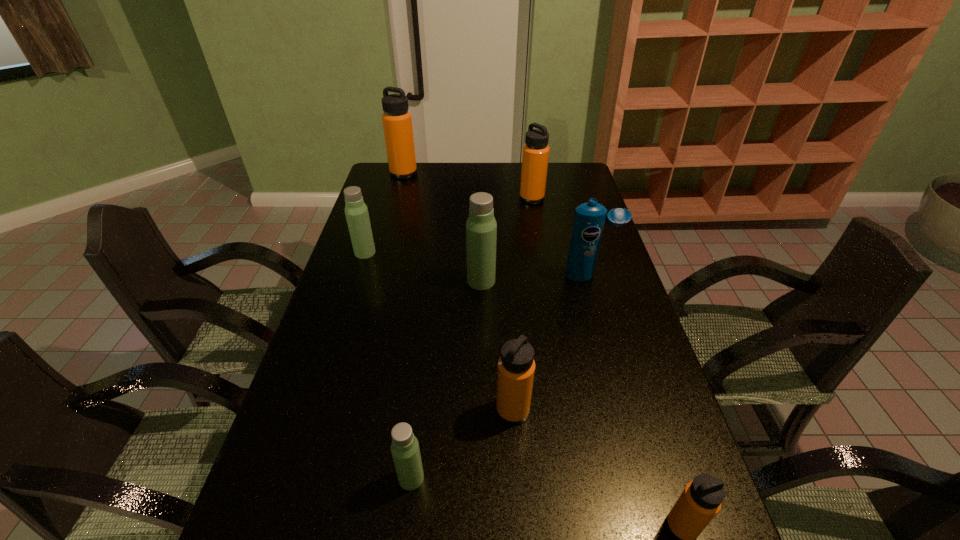
Locate an element on the screen. object at the far edge is located at coordinates (397, 121).

This screenshot has height=540, width=960. I want to click on object situated at the right edge, so click(589, 219).

Find the location of a particular element. The image size is (960, 540). object that is at the far left corner is located at coordinates (397, 121).

In the image, there is a desktop. Where is `vacant region at the left edge`? Image resolution: width=960 pixels, height=540 pixels. vacant region at the left edge is located at coordinates (280, 530).

In the image, there is a desktop. Where is `vacant area at the right edge`? This screenshot has width=960, height=540. vacant area at the right edge is located at coordinates (623, 285).

Locate an element on the screen. vacant area at the far left corner is located at coordinates (377, 169).

Find the location of a particular element. The width and height of the screenshot is (960, 540). vacant point at the far right corner is located at coordinates (558, 166).

Image resolution: width=960 pixels, height=540 pixels. Identify the location of vacant area that lies between the second light thermos bottle from right to left and the third farthest object. (388, 365).

What are the coordinates of `free space between the farthest light thermos bottle and the second nearest light thermos bottle` in the screenshot? It's located at (423, 267).

Where is `free area in between the sixth farthest thermos bottle and the second orange thermos bottle from left to right`? Image resolution: width=960 pixels, height=540 pixels. free area in between the sixth farthest thermos bottle and the second orange thermos bottle from left to right is located at coordinates (462, 444).